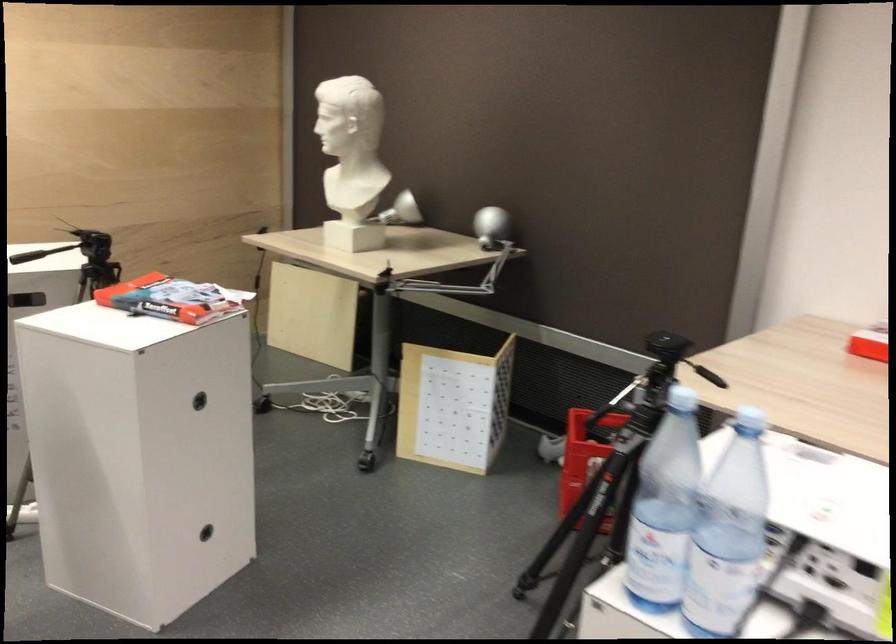
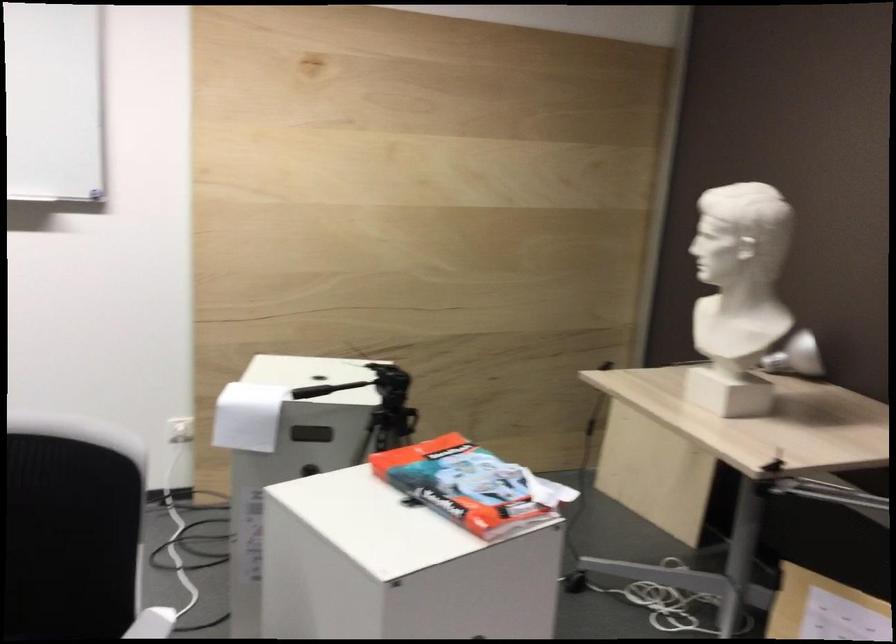
Question: In a continuous first-person perspective shot, in which direction is the camera moving?

Choices:
 (A) Left
 (B) Right
 (C) Forward
 (D) Backward

Answer: (C)